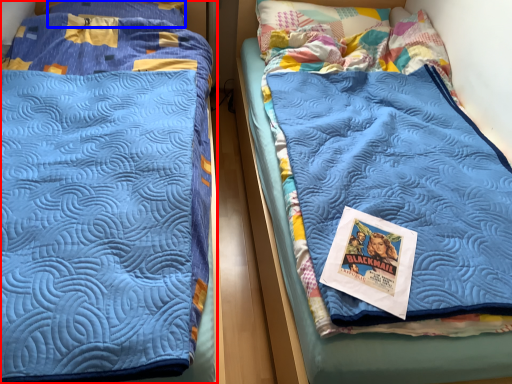
Question: Among these objects, which one is farthest to the camera, bed (highlighted by a red box) or pillow (highlighted by a blue box)?

Choices:
 (A) bed
 (B) pillow

Answer: (B)